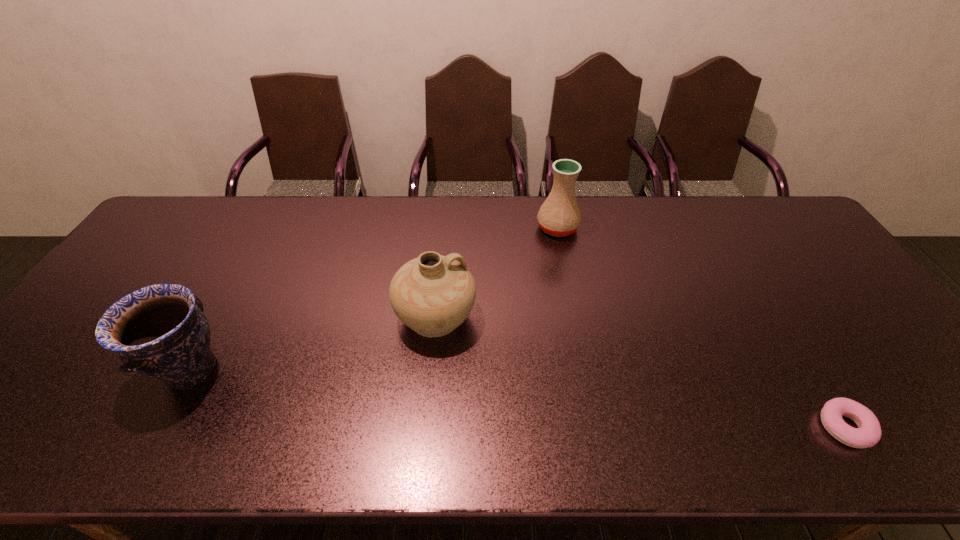
Identify the location of free space between the rightmost object and the second pottery from left to right. This screenshot has height=540, width=960. (640, 372).

At what (x,y) coordinates should I click in order to perform the action: click on free space between the second object from left to right and the farthest object. Please return your answer as a coordinate pair (x, y). Image resolution: width=960 pixels, height=540 pixels. Looking at the image, I should click on (496, 272).

Find the location of a particular element. This screenshot has width=960, height=540. free space between the leftmost object and the shortest object is located at coordinates (517, 399).

This screenshot has width=960, height=540. Identify the location of vacant area that lies between the pastry and the third object from right to left. (640, 372).

Where is `vacant area between the leftmost object and the farthest object`? This screenshot has height=540, width=960. vacant area between the leftmost object and the farthest object is located at coordinates (374, 299).

Locate an element on the screen. This screenshot has width=960, height=540. free space between the shortest object and the rightmost pottery is located at coordinates (701, 327).

This screenshot has width=960, height=540. I want to click on empty location between the farthest pottery and the third object from right to left, so click(496, 272).

Find the location of a particular element. The width and height of the screenshot is (960, 540). vacant region between the leftmost object and the second pottery from left to right is located at coordinates 313,343.

Locate an element on the screen. The height and width of the screenshot is (540, 960). object that is the nearest to the pastry is located at coordinates (559, 215).

Locate which object ranks third in proximity to the leftmost object. Please provide its 2D coordinates. Your answer should be formatted as a tuple, i.e. [(x, y)], where the tuple contains the x and y coordinates of a point satisfying the conditions above.

[(868, 433)]